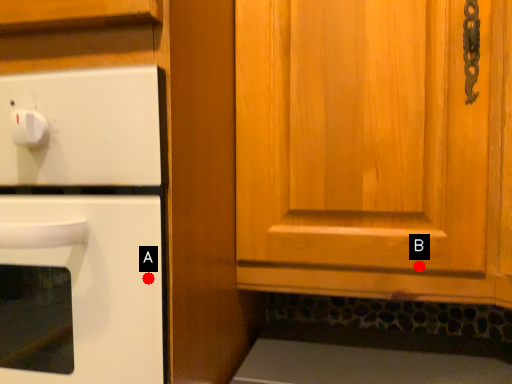
Question: Two points are circled on the image, labeled by A and B beside each circle. Which point is further to the camera?

Choices:
 (A) A is further
 (B) B is further

Answer: (B)